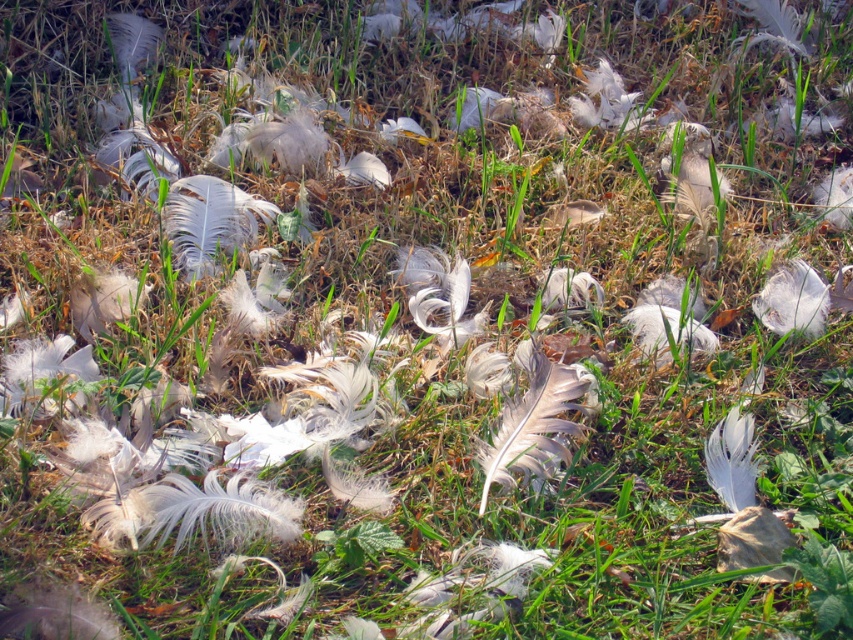
Which is more to the left, white soft feather at center or white feather at upper right?

From the viewer's perspective, white soft feather at center appears more on the left side.

Does white soft feather at center have a greater height compared to white feather at upper right?

No.

Which is behind, point (527, 435) or point (688, 161)?

The point (688, 161) is behind.

I want to click on white soft feather at center, so click(532, 422).